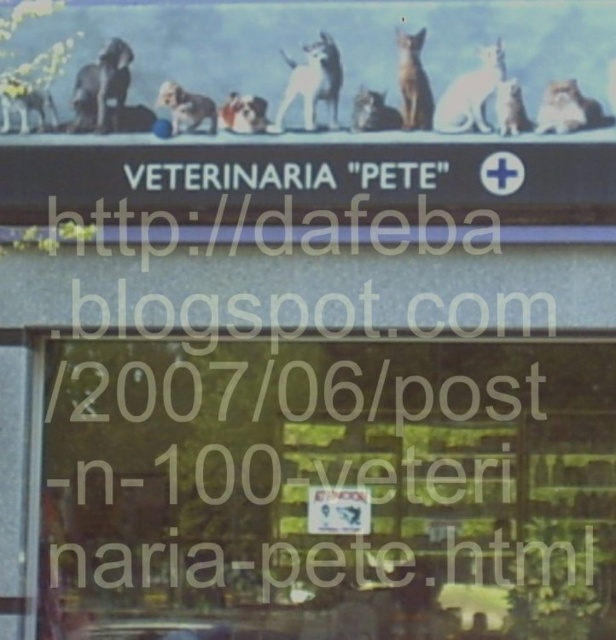
Can you confirm if white fur dog at upper left is positioned below fluffy white dog at center?

No.

Between white fur dog at upper left and fluffy white dog at center, which one is positioned lower?

fluffy white dog at center is lower down.

Is point (30, 108) positioned before point (184, 124)?

No, (30, 108) is behind (184, 124).

Locate an element on the screen. This screenshot has width=616, height=640. white fur dog at upper left is located at coordinates (25, 104).

Is transparent glass shop window at center closer to camera compared to fluffy white dog at center?

No, transparent glass shop window at center is further to the viewer.

This screenshot has height=640, width=616. Identify the location of transparent glass shop window at center. (328, 490).

Is point (34, 90) farther from viewer compared to point (224, 112)?

Yes, point (34, 90) is behind point (224, 112).

Is white fur dog at upper left to the right of white fur dog at center from the viewer's perspective?

Incorrect, white fur dog at upper left is not on the right side of white fur dog at center.

Who is more distant from viewer, (17,97) or (245,120)?

The point (17,97) is more distant.

Locate an element on the screen. This screenshot has height=640, width=616. white fur dog at upper left is located at coordinates (25, 104).